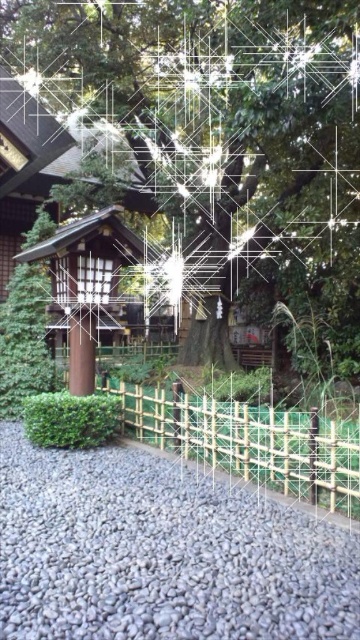
Between green leafy tree at center and gray gravel at lower center, which one has less height?

Standing shorter between the two is gray gravel at lower center.

Is green leafy tree at center to the right of gray gravel at lower center from the viewer's perspective?

No, green leafy tree at center is not to the right of gray gravel at lower center.

Is point (51, 81) less distant than point (51, 616)?

No, it is behind (51, 616).

Identify the location of green leafy tree at center. (221, 140).

Which is behind, point (251, 305) or point (159, 440)?

Positioned behind is point (251, 305).

The width and height of the screenshot is (360, 640). What do you see at coordinates (221, 140) in the screenshot?
I see `green leafy tree at center` at bounding box center [221, 140].

What are the coordinates of `green leafy tree at center` in the screenshot? It's located at (221, 140).

Can you confirm if gray gravel at lower center is positioned to the left of green bamboo fence at center?

Yes, gray gravel at lower center is to the left of green bamboo fence at center.

Between point (200, 493) and point (156, 396), which one is positioned in front?

Point (200, 493) is in front.

Where is `gray gravel at lower center`? gray gravel at lower center is located at coordinates (159, 554).